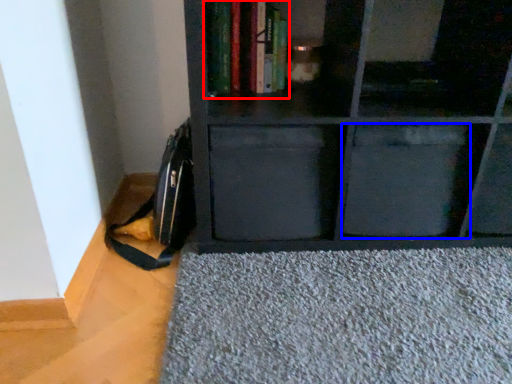
Question: Which of the following is the farthest to the observer, book (highlighted by a red box) or drawer (highlighted by a blue box)?

Choices:
 (A) book
 (B) drawer

Answer: (B)